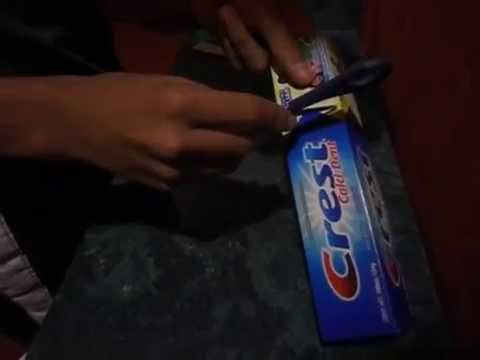
This screenshot has height=360, width=480. I want to click on handle visible, so click(x=369, y=66).